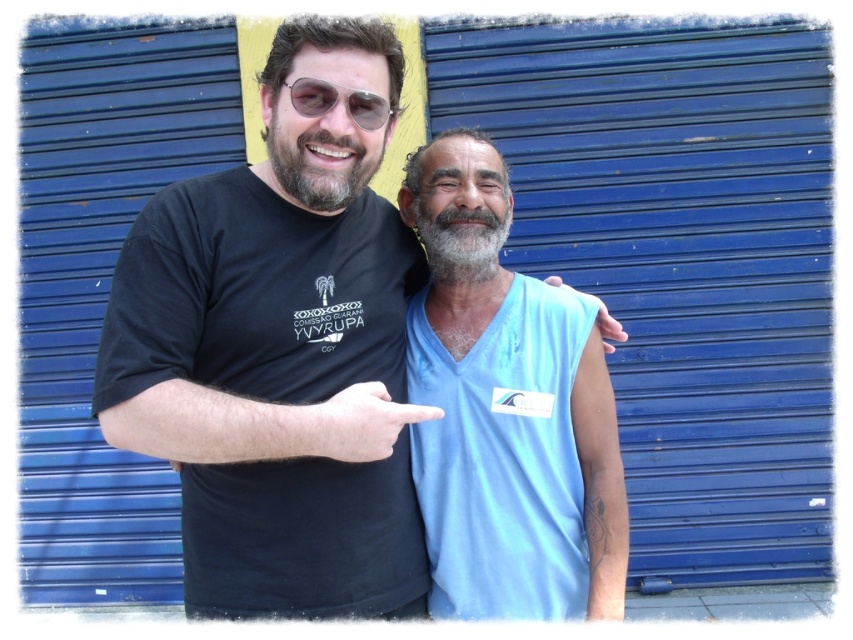
Image resolution: width=853 pixels, height=640 pixels. In order to click on light blue fabric at center in this screenshot , I will do `click(506, 410)`.

Between point (593, 412) and point (294, 422), which one is positioned behind?

Point (593, 412)

Where is `light blue fabric at center`? The width and height of the screenshot is (853, 640). light blue fabric at center is located at coordinates (506, 410).

Who is more distant from viewer, (473,246) or (294,92)?

Point (473,246)

Which is in front, point (433, 220) or point (376, 100)?

Point (376, 100)

Where is `graywoollybeard at center`? This screenshot has height=640, width=853. graywoollybeard at center is located at coordinates (460, 241).

Which is more to the left, skinny white hand at center or blue fabric sleeve at upper right?

skinny white hand at center is more to the left.

Between skinny white hand at center and blue fabric sleeve at upper right, which one is positioned lower?

skinny white hand at center is below.

Identify the location of skinny white hand at center. The image size is (853, 640). (357, 422).

The width and height of the screenshot is (853, 640). What are the coordinates of `skinny white hand at center` in the screenshot? It's located at (357, 422).